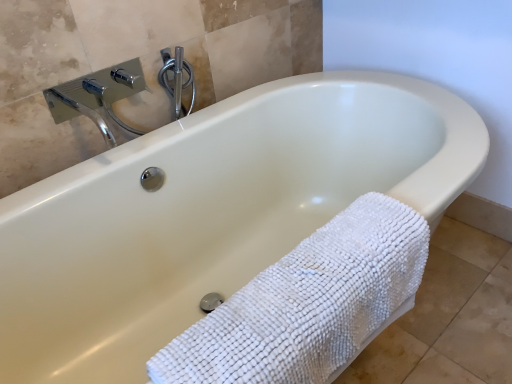
Locate an element on the screen. This screenshot has width=512, height=384. free spot above white textured towel at lower right (from a real-world perspective) is located at coordinates (295, 285).